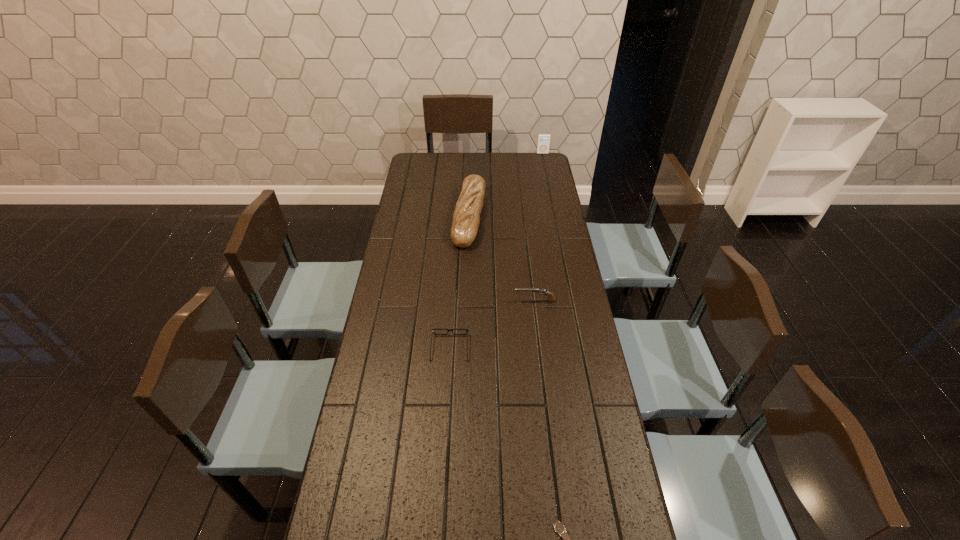
Locate which object ranks third in proximity to the nearest object. Please provide its 2D coordinates. Your answer should be formatted as a tuple, i.e. [(x, y)], where the tuple contains the x and y coordinates of a point satisfying the conditions above.

[(466, 218)]

Locate which object ranks in proximity to the iPod. Please provide its 2D coordinates. Your answer should be formatted as a tuple, i.e. [(x, y)], where the tuple contains the x and y coordinates of a point satisfying the conditions above.

[(466, 218)]

Identify the location of free location that satisfies the following two spatial constraints: 1. on the front-facing side of the farthest object; 2. aiming along the barrel of the third nearest object. Image resolution: width=960 pixels, height=540 pixels. (573, 301).